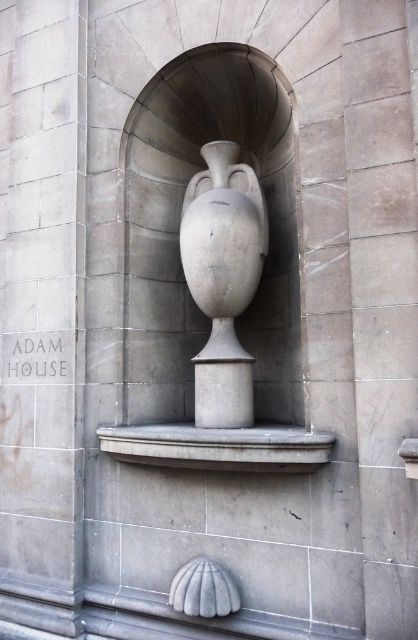
Who is higher up, white stone vase at center or gray stone ledge at center?

white stone vase at center

This screenshot has width=418, height=640. Describe the element at coordinates (222, 246) in the screenshot. I see `white stone vase at center` at that location.

You are a GUI agent. You are given a task and a screenshot of the screen. Output one action in this format:
    pyautogui.click(x=<x>, y=<y>)
    Task: Click on the white stone vase at center
    This screenshot has width=418, height=640.
    Given the screenshot: What is the action you would take?
    222,246

Can you confirm if gray stone urn at center is wider than white stone vase at center?

Correct, the width of gray stone urn at center exceeds that of white stone vase at center.

Which is above, gray stone urn at center or white stone vase at center?

gray stone urn at center

Identify the location of gray stone urn at center. (178, 232).

This screenshot has height=640, width=418. Identify the location of gray stone urn at center. click(x=178, y=232).

Is gray stone urn at center positioned in front of gray stone ledge at center?

No, it is behind gray stone ledge at center.

Based on the photo, who is more distant from viewer, (x=227, y=124) or (x=218, y=460)?

Positioned behind is point (x=227, y=124).

At what (x,y) coordinates should I click in order to perform the action: click on gray stone urn at center. Please return your answer as a coordinate pair (x, y). Looking at the image, I should click on (178, 232).